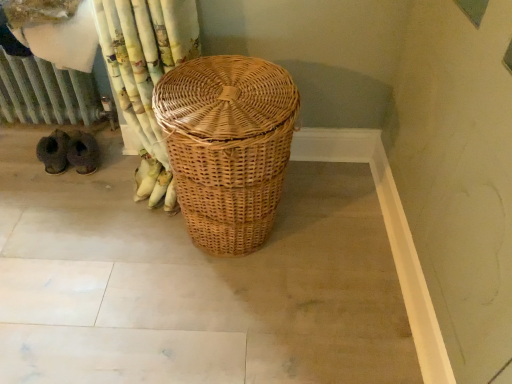
Where is `vacant region in front of metallic radiator at left`? The width and height of the screenshot is (512, 384). vacant region in front of metallic radiator at left is located at coordinates (50, 203).